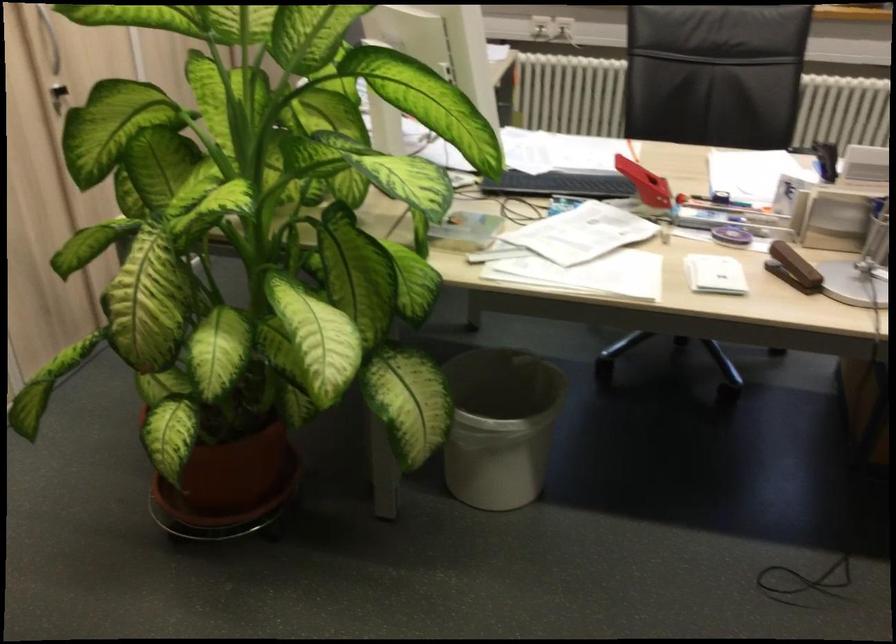
Locate an element on the screen. red stapler is located at coordinates (644, 183).